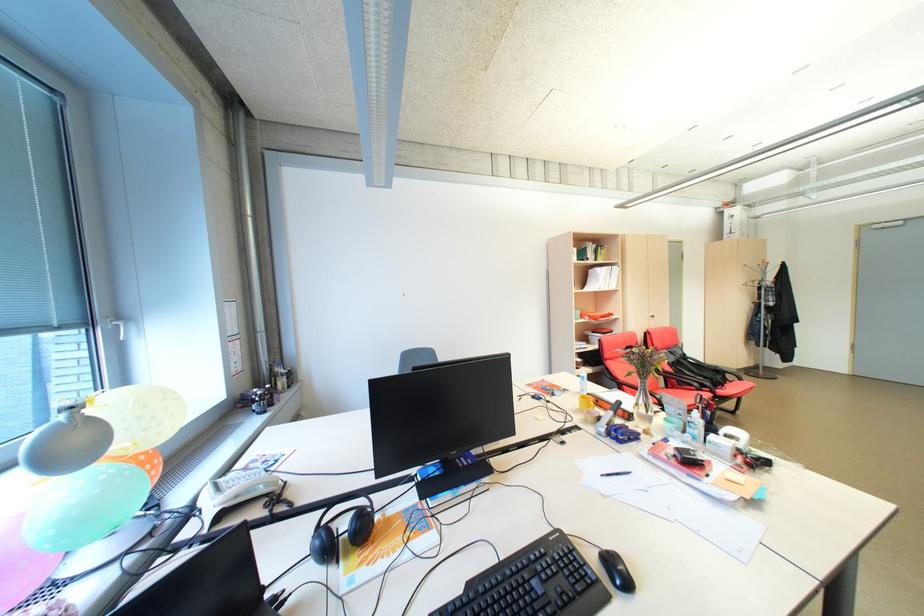
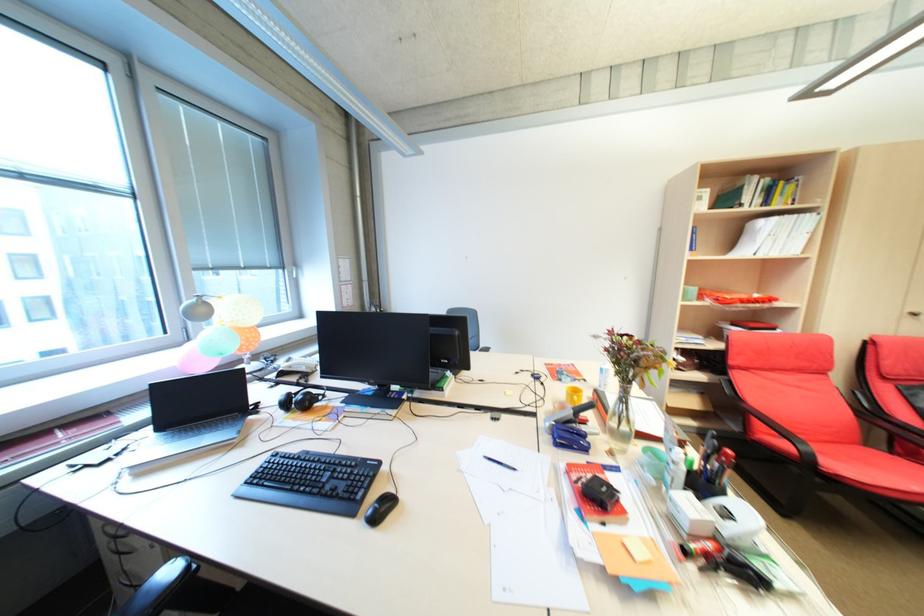
Where in the second image is the point corresponding to point (552, 556) from the first image?

(359, 467)